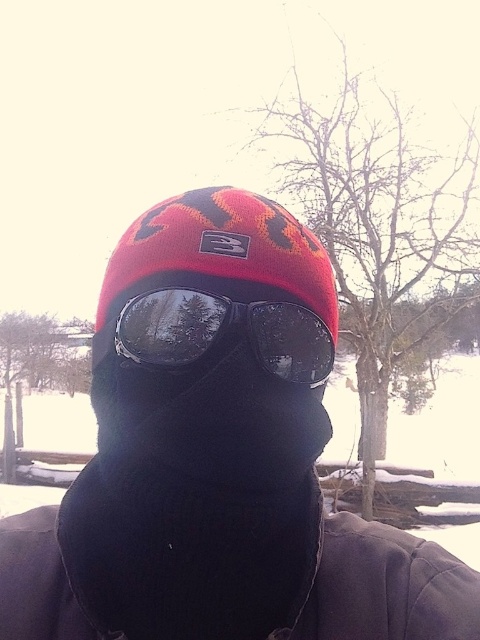
You are an observer looking at the person in the image. Which object is positioned more to the left between the matte black ski mask at center and the glossy plastic goggles at center?

The matte black ski mask at center is positioned to the left of the glossy plastic goggles at center.

You are a photographer standing 20 inches away from the person wearing the matte black ski mask at center. Can you take a clear photo of their face without moving closer?

The matte black ski mask at center is 18.90 inches away from the viewer, which is closer than your current position of 20 inches. Therefore, you cannot take a clear photo of their face without moving closer.

You are navigating through a snowy forest and need to place two markers at specific coordinates. You have to place a marker at point (x=344, y=531) and another at point (x=124, y=307). Which marker will be closer to the trees in the background?

Point (x=344, y=531) is behind point (x=124, y=307), so the marker at point (x=344, y=531) will be closer to the trees in the background.